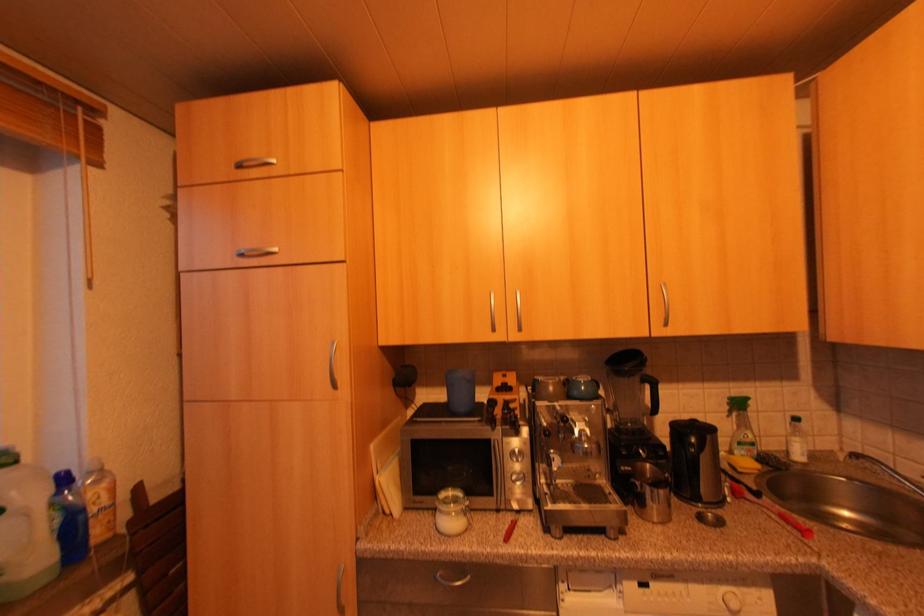
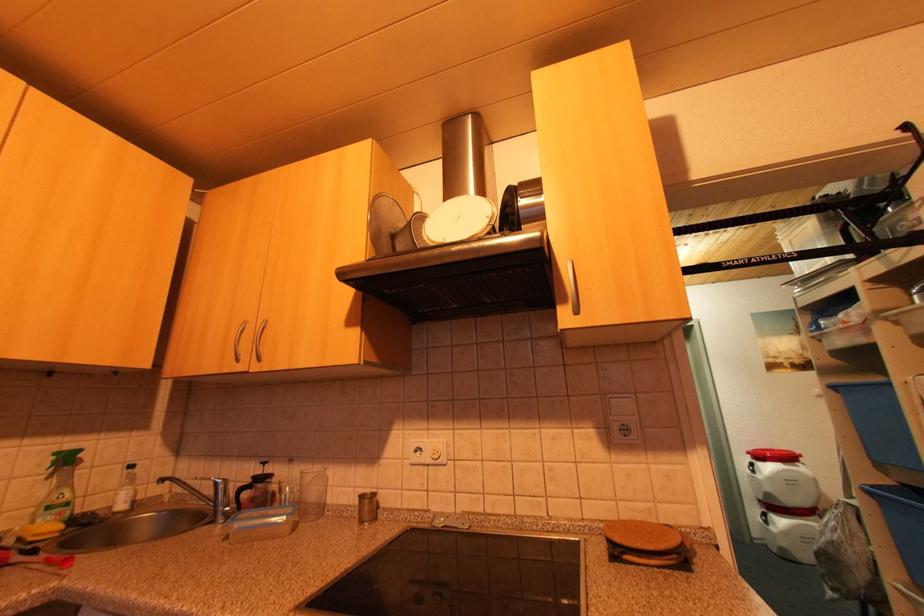
The images are taken continuously from a first-person perspective. In which direction is your viewpoint rotating?

The camera rotated toward right-up.